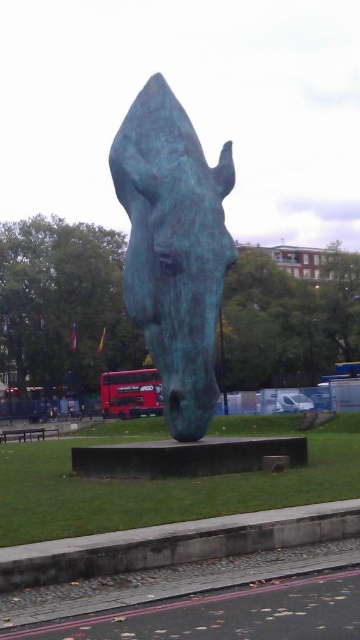
Question: Is bronze horse head at center to the right of red metallic bus at center from the viewer's perspective?

Choices:
 (A) no
 (B) yes

Answer: (B)

Question: Does bronze horse head at center lie behind red metallic bus at center?

Choices:
 (A) no
 (B) yes

Answer: (A)

Question: Which of the following is the farthest from the observer?

Choices:
 (A) bronze horse head at center
 (B) red metallic bus at center

Answer: (B)

Question: Is bronze horse head at center to the left of red metallic bus at center from the viewer's perspective?

Choices:
 (A) yes
 (B) no

Answer: (B)

Question: Which of the following is the farthest from the observer?

Choices:
 (A) (183, 340)
 (B) (104, 406)

Answer: (B)